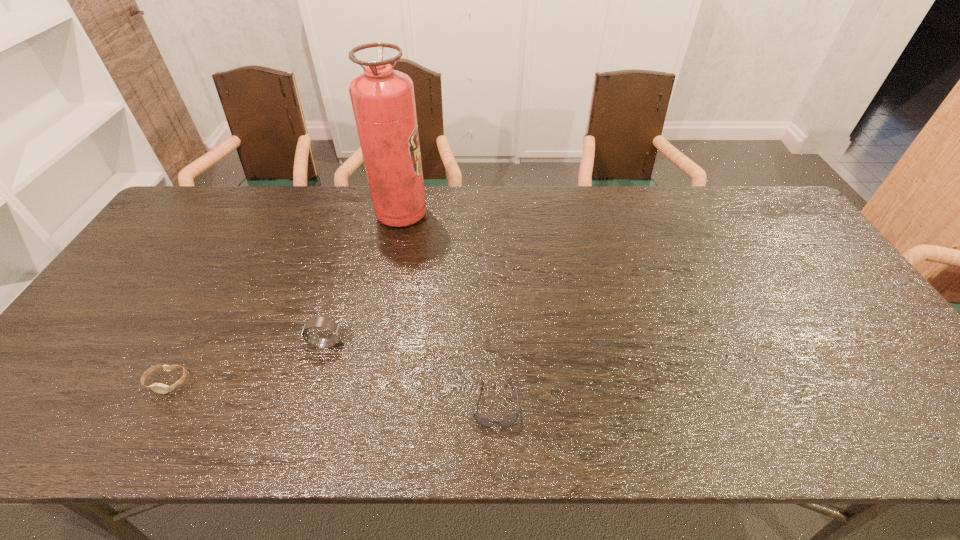
Locate an element on the screen. This screenshot has height=540, width=960. fire extinguisher is located at coordinates (383, 102).

Find the location of a particular element. The width and height of the screenshot is (960, 540). the tallest object is located at coordinates (383, 102).

Identify the location of the farther watch. (323, 322).

Locate an element on the screen. The image size is (960, 540). the third nearest object is located at coordinates (323, 322).

I want to click on the nearer watch, so click(156, 387).

You are a GUI agent. You are given a task and a screenshot of the screen. Output one action in this format:
    pyautogui.click(x=<x>, y=<y>)
    Task: Click on the shorter watch
    The image size is (960, 540).
    Given the screenshot: What is the action you would take?
    pyautogui.click(x=156, y=387)

This screenshot has width=960, height=540. I want to click on the rightmost object, so click(x=481, y=420).

You are a GUI agent. You are given a task and a screenshot of the screen. Output one action in this format:
    pyautogui.click(x=<x>, y=<y>)
    Task: Click on the vacant region located on the label side of the tallest object
    The image size is (960, 540).
    Given the screenshot: What is the action you would take?
    pyautogui.click(x=464, y=215)

You are a GUI agent. You are given a task and a screenshot of the screen. Output one action in this format:
    pyautogui.click(x=<x>, y=<y>)
    Task: Click on the vacant position located 0.270m on the face of the right watch
    This screenshot has height=540, width=960.
    Given the screenshot: What is the action you would take?
    pyautogui.click(x=452, y=343)

What are the coordinates of `free space located on the face of the leftmost object` in the screenshot? It's located at (147, 419).